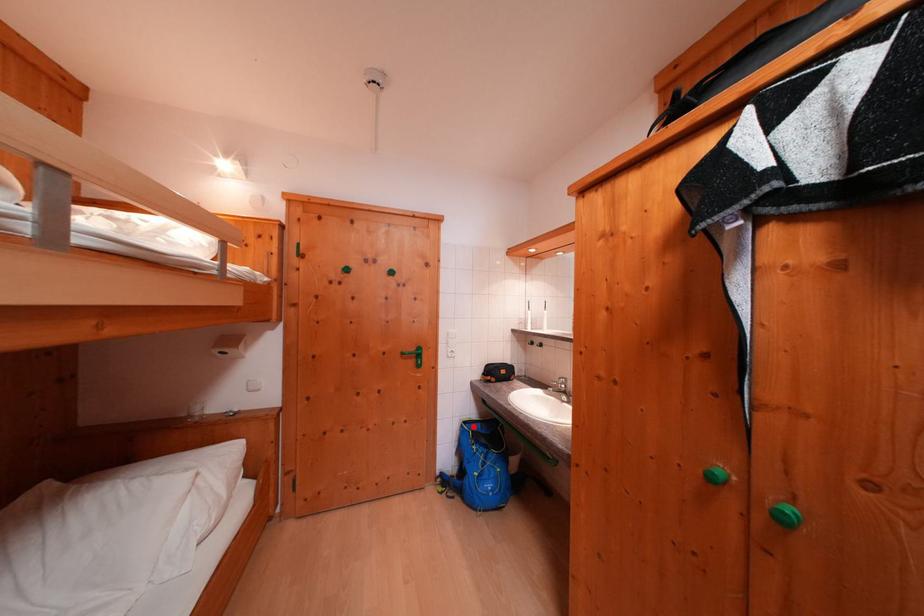
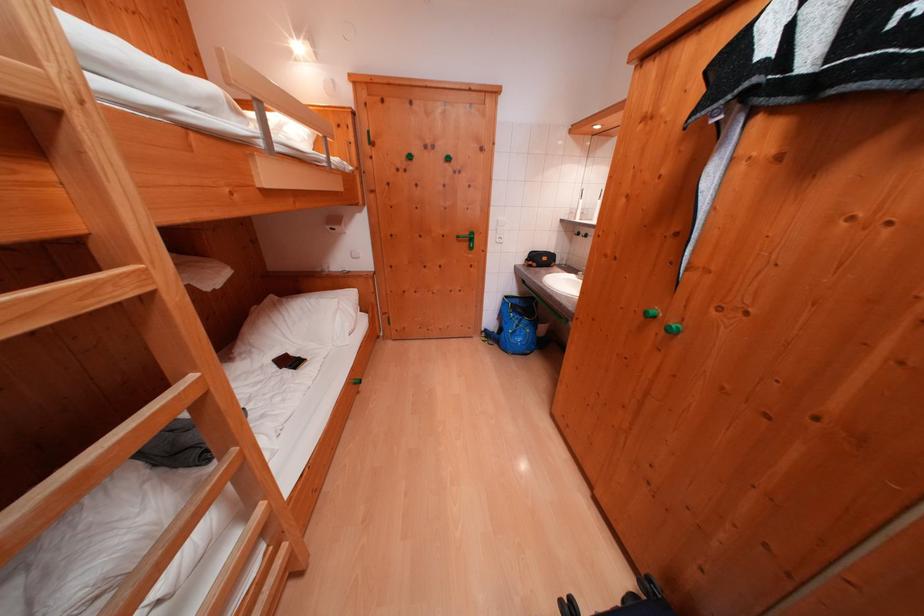
Where in the second image is the point corresponding to the highlighted location from the first image?

(515, 301)